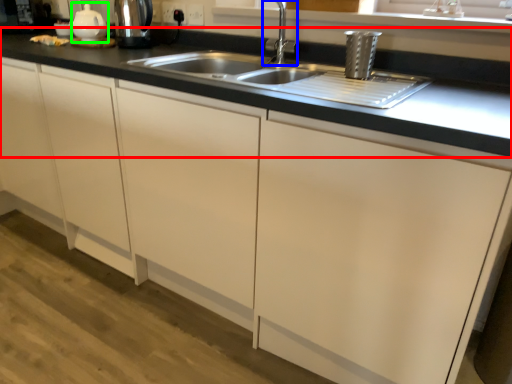
Question: Which object is positioned farthest from countertop (highlighted by a red box)? Select from tap (highlighted by a blue box) and tea pot (highlighted by a green box).

Choices:
 (A) tap
 (B) tea pot

Answer: (B)